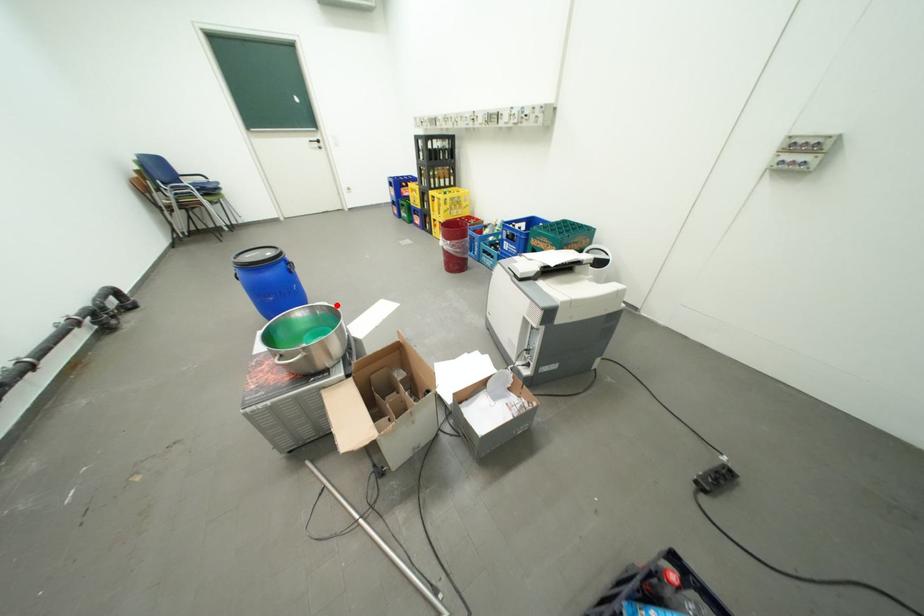
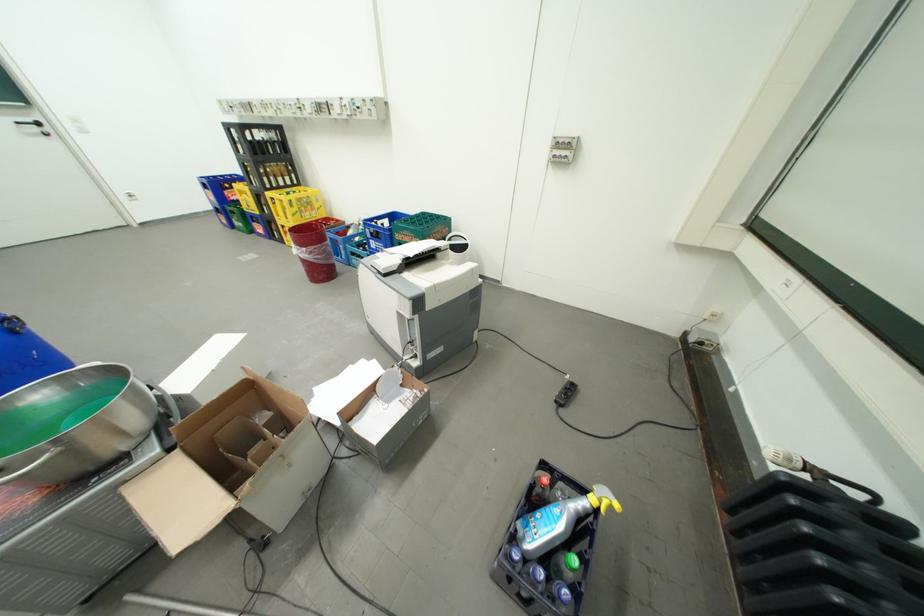
Where in the second image is the point corresponding to the highlighted location from the first image?

(108, 365)